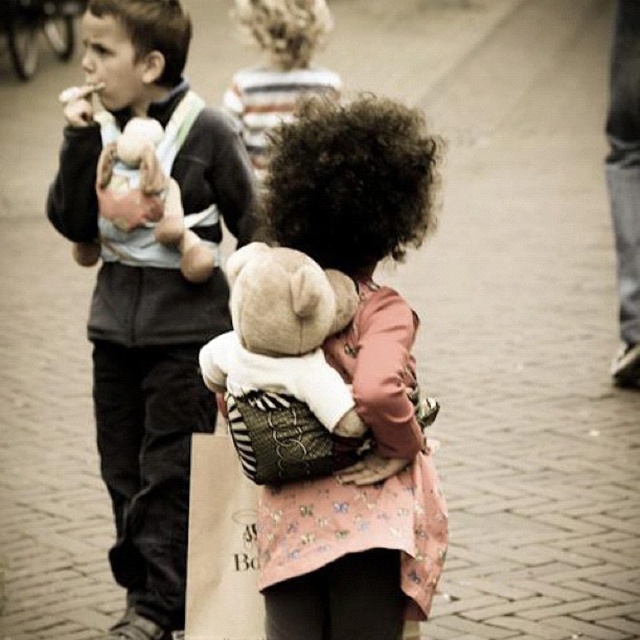
Is matte black jacket at left below fluffy beige teddy bear at center?

Incorrect, matte black jacket at left is not positioned below fluffy beige teddy bear at center.

Measure the distance between matte black jacket at left and fluffy beige teddy bear at center.

matte black jacket at left and fluffy beige teddy bear at center are 2.53 meters apart.

Between point (164, 44) and point (234, 390), which one is positioned behind?

The point (164, 44) is more distant.

You are a GUI agent. You are given a task and a screenshot of the screen. Output one action in this format:
    pyautogui.click(x=<x>, y=<y>)
    Task: Click on the matte black jacket at left
    
    Given the screenshot: What is the action you would take?
    pyautogui.click(x=138, y=310)

Which is in front, point (166, 396) or point (326, 477)?

Point (326, 477)

Measure the distance between matte black jacket at left and camera.

matte black jacket at left is 25.68 feet from camera.

Is point (128, 93) behind point (348, 552)?

Yes, it is behind point (348, 552).

Find the location of a particular element. matte black jacket at left is located at coordinates (138, 310).

Is fluffy pink sweater at center bigger than fluffy beige teddy bear at center?

Yes.

Does fluffy pink sweater at center have a lesser width compared to fluffy beige teddy bear at center?

In fact, fluffy pink sweater at center might be wider than fluffy beige teddy bear at center.

Is point (332, 240) closer to viewer compared to point (268, 365)?

No, (332, 240) is further to viewer.

The image size is (640, 640). In order to click on fluffy pink sweater at center in this screenshot , I will do `click(356, 376)`.